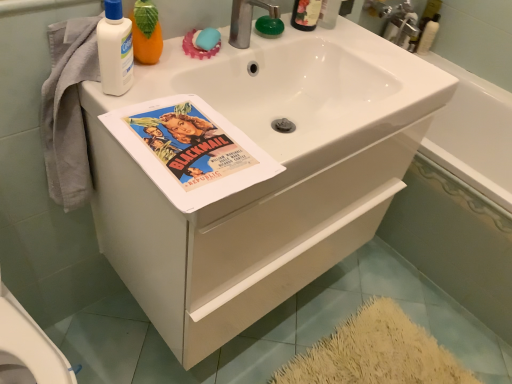
This screenshot has height=384, width=512. Identify the location of free spot behind white matte lotion at upper left, positioned as the 2th cleaning product in right-to-left order. (173, 62).